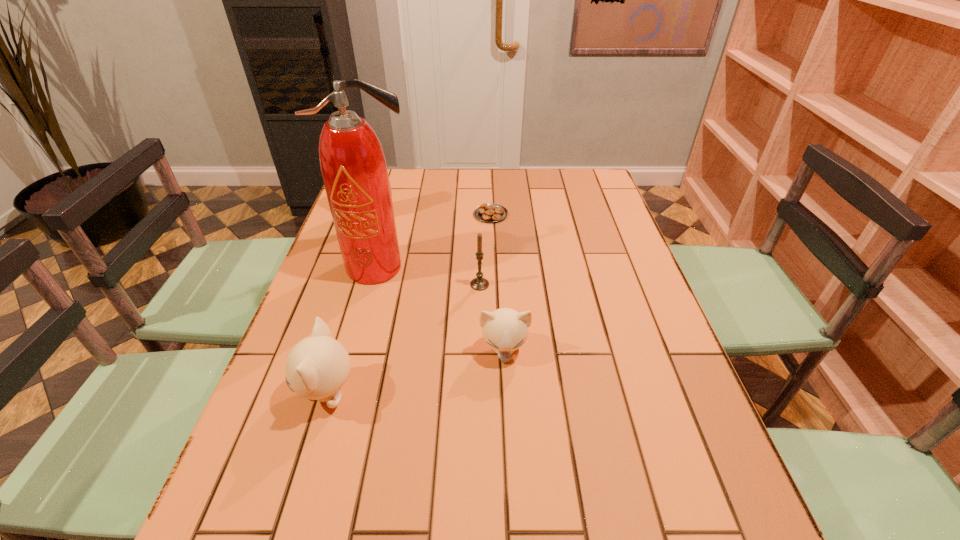
At what (x,y) coordinates should I click in order to perform the action: click on the taller kitten. Please return your answer as a coordinate pair (x, y). This screenshot has width=960, height=540. Looking at the image, I should click on [x=318, y=366].

Locate an element on the screen. The image size is (960, 540). the shorter kitten is located at coordinates (505, 330).

This screenshot has width=960, height=540. Identify the location of the right kitten. (505, 330).

The width and height of the screenshot is (960, 540). I want to click on the shortest object, so click(x=490, y=212).

Locate an element on the screen. The image size is (960, 540). fire extinguisher is located at coordinates (353, 166).

At what (x,y) coordinates should I click in order to perform the action: click on the fifth shortest object. Please return your answer as a coordinate pair (x, y). The height and width of the screenshot is (540, 960). Looking at the image, I should click on (389, 180).

Locate an element on the screen. candle is located at coordinates (479, 283).

Identify the location of vacant space located 0.270m on the face of the right kitten. (512, 491).

Locate an element on the screen. vacant space located on the back of the shortest object is located at coordinates (491, 198).

You are a GUI agent. You are given a task and a screenshot of the screen. Output one action in this format:
    pyautogui.click(x=<x>, y=<y>)
    Task: Click on the free space located on the back of the fire extinguisher
    
    Given the screenshot: What is the action you would take?
    pyautogui.click(x=396, y=204)